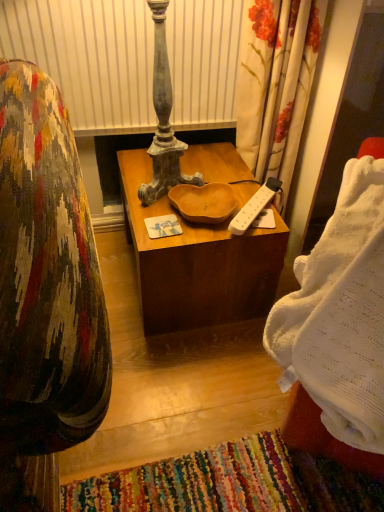
Where is `free space in front of wooden at center`? free space in front of wooden at center is located at coordinates (183, 378).